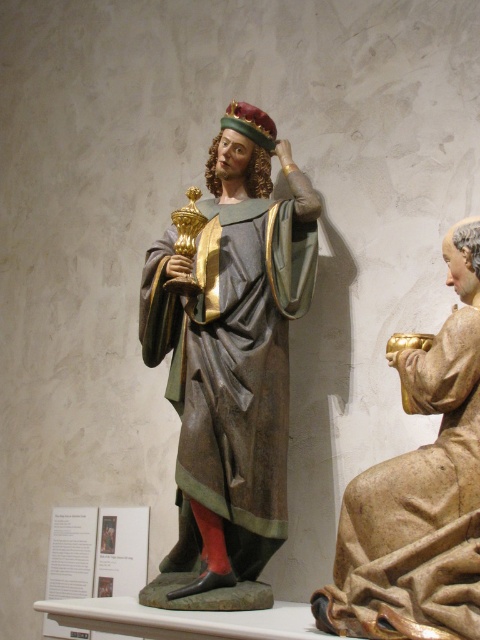
Question: Does polychrome wood statue at center have a smaller size compared to wooden cup at right?

Choices:
 (A) yes
 (B) no

Answer: (B)

Question: Which object is closer to the camera taking this photo?

Choices:
 (A) wooden cup at right
 (B) polychrome wood statue at center

Answer: (A)

Question: Which point is closer to the camera?

Choices:
 (A) (226, 248)
 (B) (391, 616)

Answer: (B)

Question: In this image, where is polychrome wood statue at center located relative to wooden cup at right?

Choices:
 (A) left
 (B) right

Answer: (A)

Question: Is polychrome wood statue at center thinner than wooden cup at right?

Choices:
 (A) yes
 (B) no

Answer: (B)